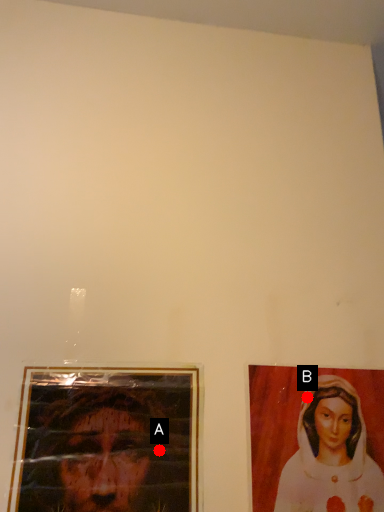
Question: Two points are circled on the image, labeled by A and B beside each circle. Which point is farther from the camera taking this photo?

Choices:
 (A) A is further
 (B) B is further

Answer: (B)